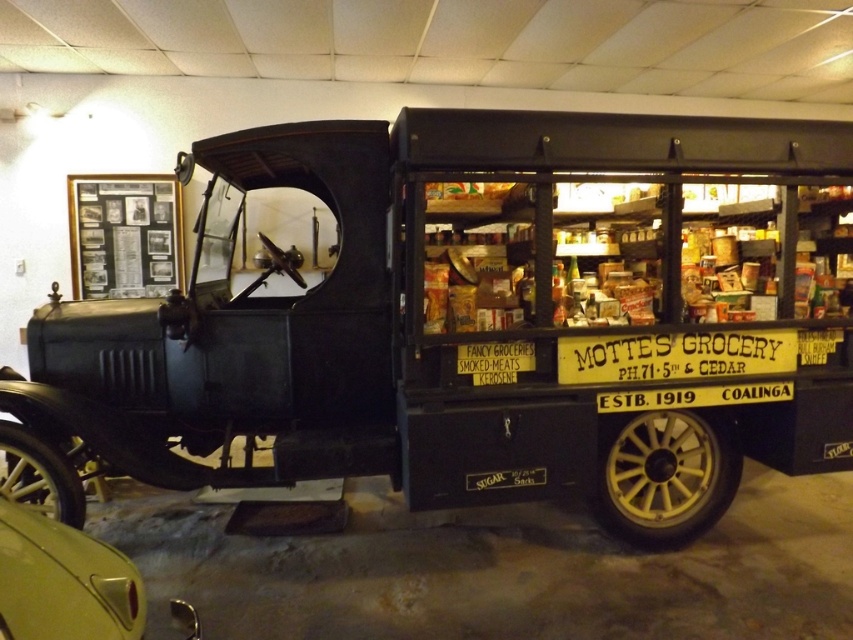
You are a photographer planning to take a photo of the matte black truck at center and the metallic gold car at lower left. Since you want both vehicles to appear equally sized in the final image, which vehicle should you move closer to the camera?

The matte black truck at center is bigger than the metallic gold car at lower left. To make them appear the same size in the photo, move the matte black truck at center farther away from the camera and the metallic gold car at lower left closer to the camera.

Based on the photo, you are a visitor at the museum and want to take a photo of the matte black truck at center and the metallic gold car at lower left. Which one is on the right side when facing the scene?

The matte black truck at center is positioned on the right side of the metallic gold car at lower left, so when facing the scene, the matte black truck at center is on the right side.

You are a tour guide giving a tour of a vintage vehicle exhibition. You notice a matte black truck at center and a metallic gold car at lower left. Which vehicle is closer to the visitors standing at the entrance?

The matte black truck at center is closer to the visitors because it is positioned further to the viewer compared to the metallic gold car at lower left, which is placed farther back in the exhibition space.